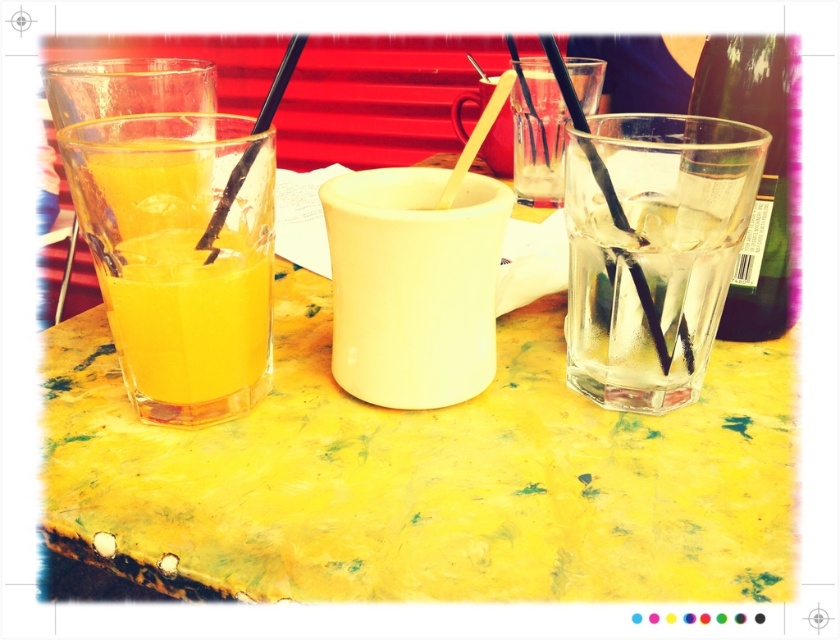
Question: Can you confirm if transparent plastic straw at right is wider than transparent plastic straw at left?

Choices:
 (A) no
 (B) yes

Answer: (B)

Question: Which point is farther from the camera taking this photo?

Choices:
 (A) (130, 292)
 (B) (302, 42)
 (C) (255, 316)
 (D) (621, 212)

Answer: (C)

Question: Considering the real-world distances, which object is farthest from the translucent glass juice at left?

Choices:
 (A) transparent plastic straw at right
 (B) translucent glass orange juice at left
 (C) transparent plastic straw at left

Answer: (A)

Question: Among these objects, which one is farthest from the camera?

Choices:
 (A) green glass bottle at right
 (B) white matte cup at center

Answer: (A)

Question: Is translucent glass orange juice at left smaller than white matte cup at center?

Choices:
 (A) yes
 (B) no

Answer: (B)

Question: Does translucent glass juice at left have a greater width compared to transparent plastic straw at left?

Choices:
 (A) yes
 (B) no

Answer: (A)